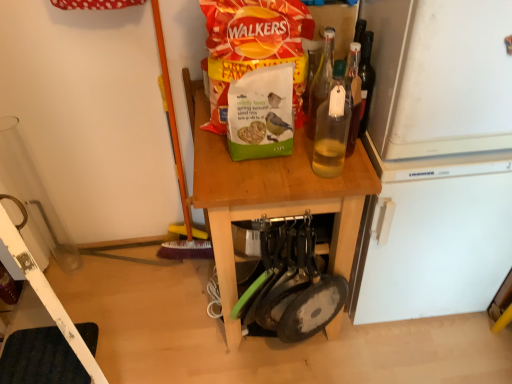
This screenshot has width=512, height=384. Describe the element at coordinates (270, 196) in the screenshot. I see `wooden table at center` at that location.

I want to click on white plastic ladder at lower left, so click(45, 330).

Where is `translucent glass bottle at center, the first bottle in the back-to-front sequence`? This screenshot has height=384, width=512. translucent glass bottle at center, the first bottle in the back-to-front sequence is located at coordinates (321, 81).

What are the coordinates of `white matte refrigerator at right` in the screenshot? It's located at (437, 159).

Where is `transparent glass bottle at center, the second bottle when ordered from back to front`? This screenshot has width=512, height=384. transparent glass bottle at center, the second bottle when ordered from back to front is located at coordinates (332, 127).

You are a GUI agent. You are given a task and a screenshot of the screen. Output one action in this format:
    pyautogui.click(x=<x>, y=<y>)
    Task: Click on the wooden table at center
    The image size is (512, 384).
    Given the screenshot: What is the action you would take?
    pyautogui.click(x=270, y=196)

Does white plastic ladder at lower left have a smaller size compared to transparent glass bottle at center, which appears as the first bottle when viewed from the front?

No, white plastic ladder at lower left is not smaller than transparent glass bottle at center, which appears as the first bottle when viewed from the front.

Which object is wider, white plastic ladder at lower left or transparent glass bottle at center, which appears as the first bottle when viewed from the front?

With larger width is transparent glass bottle at center, which appears as the first bottle when viewed from the front.

Is white plastic ladder at lower left oriented towards transparent glass bottle at center, which appears as the first bottle when viewed from the front?

No.

From the image's perspective, which is below, white plastic ladder at lower left or white matte refrigerator at right?

white plastic ladder at lower left, from the image's perspective.

How different are the orientations of white plastic ladder at lower left and white matte refrigerator at right in degrees?

The angular difference between white plastic ladder at lower left and white matte refrigerator at right is 50.7 degrees.

Is white plastic ladder at lower left aimed at white matte refrigerator at right?

No, white plastic ladder at lower left is not turned towards white matte refrigerator at right.

Looking at their sizes, would you say white plastic ladder at lower left is wider or thinner than white matte refrigerator at right?

Considering their sizes, white plastic ladder at lower left looks slimmer than white matte refrigerator at right.

From the image's perspective, is translucent glass bottle at center, which appears as the 2th bottle when viewed from the front, under white matte refrigerator at right?

Actually, translucent glass bottle at center, which appears as the 2th bottle when viewed from the front, appears above white matte refrigerator at right in the image.

Is white matte refrigerator at right a part of translucent glass bottle at center, the first bottle in the back-to-front sequence?

No, white matte refrigerator at right is not a part of translucent glass bottle at center, the first bottle in the back-to-front sequence.

Considering the sizes of objects translucent glass bottle at center, the first bottle in the back-to-front sequence, and white matte refrigerator at right in the image provided, who is smaller, translucent glass bottle at center, the first bottle in the back-to-front sequence, or white matte refrigerator at right?

translucent glass bottle at center, the first bottle in the back-to-front sequence.

You are a GUI agent. You are given a task and a screenshot of the screen. Output one action in this format:
    pyautogui.click(x=<x>, y=<y>)
    Task: Click on the bottle that is behind the green matte birdseed packet at center
    
    Given the screenshot: What is the action you would take?
    pyautogui.click(x=321, y=81)

Would you consider green matte birdseed packet at center to be distant from translucent glass bottle at center, which appears as the 2th bottle when viewed from the front?

That's not correct — green matte birdseed packet at center is a little close to translucent glass bottle at center, which appears as the 2th bottle when viewed from the front.

Considering the positions of points (216, 5) and (327, 85), is point (216, 5) farther from camera compared to point (327, 85)?

Yes, point (216, 5) is farther from viewer.

What's the angular difference between green matte birdseed packet at center and translucent glass bottle at center, which appears as the 2th bottle when viewed from the front,'s facing directions?

2.8 degrees.

Can you confirm if transparent glass bottle at center, the second bottle when ordered from back to front, is wider than white plastic ladder at lower left?

Yes, transparent glass bottle at center, the second bottle when ordered from back to front, is wider than white plastic ladder at lower left.

Is transparent glass bottle at center, which appears as the first bottle when viewed from the front, with white plastic ladder at lower left?

transparent glass bottle at center, which appears as the first bottle when viewed from the front, and white plastic ladder at lower left are clearly separated.

Which object is positioned more to the right, transparent glass bottle at center, which appears as the first bottle when viewed from the front, or white plastic ladder at lower left?

From the viewer's perspective, transparent glass bottle at center, which appears as the first bottle when viewed from the front, appears more on the right side.

From the image's perspective, relative to white plastic ladder at lower left, is transparent glass bottle at center, which appears as the first bottle when viewed from the front, above or below?

Result: transparent glass bottle at center, which appears as the first bottle when viewed from the front, is above white plastic ladder at lower left.

From the picture: Visually, is wooden table at center positioned to the left or to the right of white matte refrigerator at right?

From the image, it's evident that wooden table at center is to the left of white matte refrigerator at right.

Is wooden table at center bigger than white matte refrigerator at right?

Correct, wooden table at center is larger in size than white matte refrigerator at right.

Is wooden table at center touching white matte refrigerator at right?

wooden table at center is not next to white matte refrigerator at right, and they're not touching.

Considering their positions, is wooden table at center located in front of or behind white matte refrigerator at right?

wooden table at center is positioned closer to the viewer than white matte refrigerator at right.

From the image's perspective, which one is positioned higher, translucent glass bottle at center, which appears as the 2th bottle when viewed from the front, or wooden table at center?

From the image's view, translucent glass bottle at center, which appears as the 2th bottle when viewed from the front, is above.

Does translucent glass bottle at center, the first bottle in the back-to-front sequence, come in front of wooden table at center?

Yes, translucent glass bottle at center, the first bottle in the back-to-front sequence, is closer to the camera.

Is translucent glass bottle at center, which appears as the 2th bottle when viewed from the front, facing towards wooden table at center?

No.

Considering the points (328, 43) and (289, 203), which point is in front, point (328, 43) or point (289, 203)?

Point (328, 43)

Find the location of a particular element. ladder that is under the transparent glass bottle at center, the second bottle when ordered from back to front (from a real-world perspective) is located at coordinates (45, 330).

At what (x,y) coordinates should I click in order to perform the action: click on appliance above the white plastic ladder at lower left (from the image's perspective). Please return your answer as a coordinate pair (x, y). Looking at the image, I should click on (437, 159).

Estimate the real-world distances between objects in this image. Which object is further from white matte refrigerator at right, white plastic ladder at lower left or transparent glass bottle at center, the second bottle when ordered from back to front?

Based on the image, white plastic ladder at lower left appears to be further to white matte refrigerator at right.

Consider the image. Estimate the real-world distances between objects in this image. Which object is closer to white plastic ladder at lower left, transparent glass bottle at center, which appears as the first bottle when viewed from the front, or green matte birdseed packet at center?

green matte birdseed packet at center.

Which object lies nearer to the anchor point white plastic ladder at lower left, transparent glass bottle at center, which appears as the first bottle when viewed from the front, or white matte refrigerator at right?

transparent glass bottle at center, which appears as the first bottle when viewed from the front, lies closer to white plastic ladder at lower left than the other object.

Based on their spatial positions, is green matte birdseed packet at center or translucent glass bottle at center, the first bottle in the back-to-front sequence, further from wooden table at center?

translucent glass bottle at center, the first bottle in the back-to-front sequence, lies further to wooden table at center than the other object.

Looking at the image, which one is located further to translucent glass bottle at center, which appears as the 2th bottle when viewed from the front, white matte refrigerator at right or transparent glass bottle at center, which appears as the first bottle when viewed from the front?

white matte refrigerator at right is further to translucent glass bottle at center, which appears as the 2th bottle when viewed from the front.

When comparing their distances from green matte birdseed packet at center, does white matte refrigerator at right or translucent glass bottle at center, which appears as the 2th bottle when viewed from the front, seem closer?

Among the two, translucent glass bottle at center, which appears as the 2th bottle when viewed from the front, is located nearer to green matte birdseed packet at center.

Considering their positions, is wooden table at center positioned closer to white matte refrigerator at right than green matte birdseed packet at center?

wooden table at center is positioned closer to the anchor white matte refrigerator at right.

Looking at the image, which one is located further to white plastic ladder at lower left, transparent glass bottle at center, the second bottle when ordered from back to front, or translucent glass bottle at center, the first bottle in the back-to-front sequence?

translucent glass bottle at center, the first bottle in the back-to-front sequence, is positioned further to the anchor white plastic ladder at lower left.

This screenshot has width=512, height=384. Identify the location of furniture between green matte birdseed packet at center and white matte refrigerator at right in the horizontal direction. (270, 196).

Locate an element on the screen. This screenshot has width=512, height=384. furniture situated between white plastic ladder at lower left and translucent glass bottle at center, which appears as the 2th bottle when viewed from the front, from left to right is located at coordinates (270, 196).

Image resolution: width=512 pixels, height=384 pixels. I want to click on cereal between white plastic ladder at lower left and white matte refrigerator at right from left to right, so click(253, 47).

Locate an element on the screen. bottle located between transparent glass bottle at center, which appears as the first bottle when viewed from the front, and white matte refrigerator at right in the left-right direction is located at coordinates (321, 81).